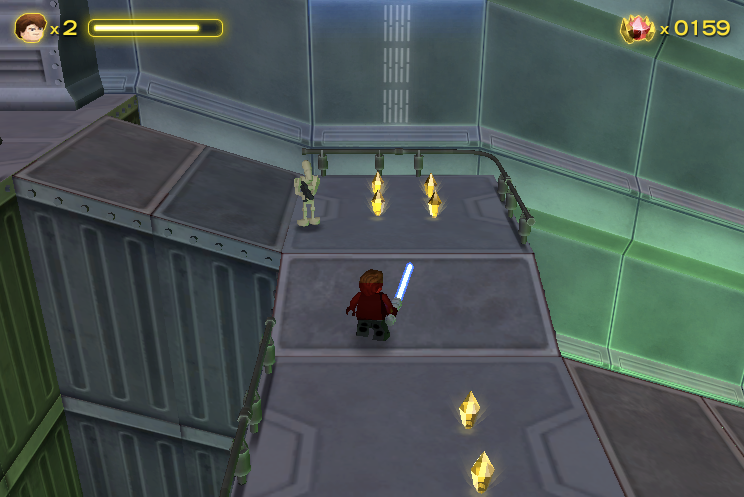
What are the coordinates of `glowing green walls` in the screenshot? It's located at (591, 255), (689, 308).